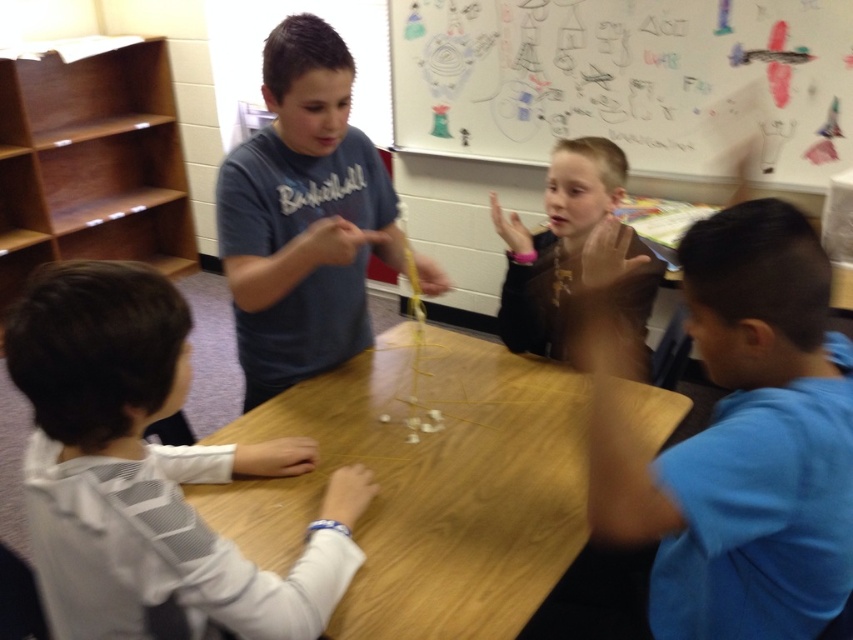
Who is more distant from viewer, (798,356) or (520,561)?

The point (520,561) is behind.

Which is more to the left, blue cotton shirt at lower right or wooden table at center?

From the viewer's perspective, wooden table at center appears more on the left side.

Does point (683, 269) come in front of point (573, 387)?

Yes, it is.

Find the location of a particular element. blue cotton shirt at lower right is located at coordinates (738, 440).

This screenshot has height=640, width=853. I want to click on white mesh shirt at lower left, so click(x=149, y=474).

Can you confirm if white mesh shirt at lower left is smaller than dark brown leather jacket at center?

Incorrect, white mesh shirt at lower left is not smaller in size than dark brown leather jacket at center.

Is point (97, 621) positioned behind point (527, 337)?

No, it is not.

Image resolution: width=853 pixels, height=640 pixels. I want to click on white mesh shirt at lower left, so click(x=149, y=474).

Does blue cotton shirt at lower right appear under matte gray shirt at center?

Yes.

Is point (807, 314) positioned before point (354, 131)?

Yes, point (807, 314) is in front of point (354, 131).

This screenshot has height=640, width=853. In order to click on blue cotton shirt at lower right in this screenshot , I will do `click(738, 440)`.